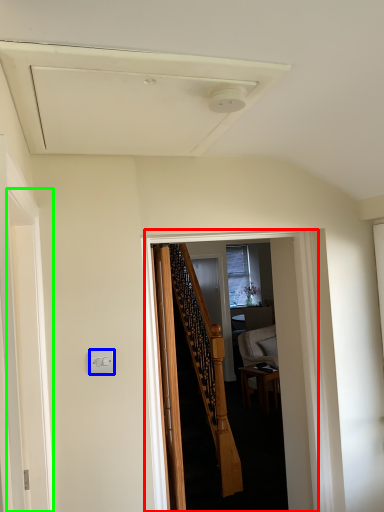
Question: Based on their relative distances, which object is farther from corridor (highlighted by a red box)? Choose from electric outlet (highlighted by a blue box) and screen door (highlighted by a green box).

Choices:
 (A) electric outlet
 (B) screen door

Answer: (B)